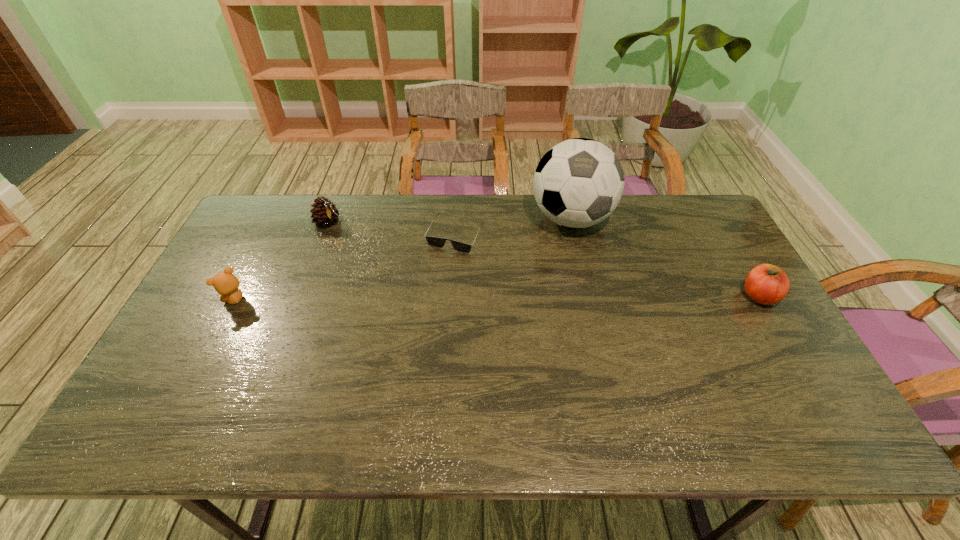
Find the location of a particular element. blank area in the image that satisfies the following two spatial constraints: 1. on the back side of the soccer ball; 2. on the left side of the third object from left to right is located at coordinates tap(457, 219).